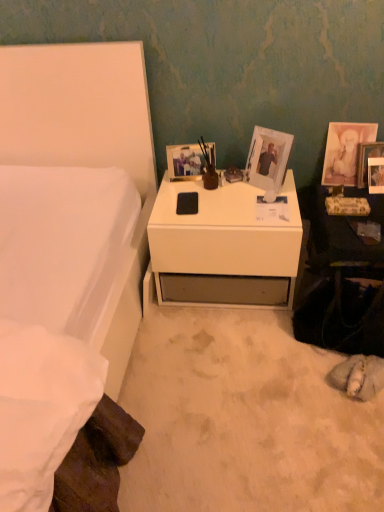
This screenshot has width=384, height=512. What do you see at coordinates (367, 160) in the screenshot? I see `matte white picture frame at upper right, the 4th picture frame in the left-to-right sequence` at bounding box center [367, 160].

Find the location of a particular element. The height and width of the screenshot is (512, 384). white plastic picture frame at upper center, acting as the 3th picture frame starting from the right is located at coordinates (268, 158).

What is the approximate width of matte white picture frame at upper right, acting as the second picture frame starting from the right?

matte white picture frame at upper right, acting as the second picture frame starting from the right, is 2.50 inches wide.

The image size is (384, 512). In order to click on white matte bed at left in this screenshot , I will do `click(87, 148)`.

Find the location of a particular element. matte plastic picture frame at center, the fourth picture frame from the right is located at coordinates (185, 162).

I want to click on matte white picture frame at upper right, the 4th picture frame in the left-to-right sequence, so click(367, 160).

From the image's perspective, between white matte bed at left and white matte desk at center, who is located below?

white matte bed at left appears lower in the image.

Is white matte bed at left to the left of white matte desk at center from the viewer's perspective?

Yes, white matte bed at left is to the left of white matte desk at center.

Choose the correct answer: Is white matte bed at left inside white matte desk at center or outside it?

white matte bed at left is outside white matte desk at center.

In terms of width, does white matte bed at left look wider or thinner when compared to white matte desk at center?

In the image, white matte bed at left appears to be wider than white matte desk at center.

Is white plastic picture frame at upper center, acting as the 3th picture frame starting from the right, aimed at matte plastic picture frame at center, the first picture frame positioned from the left?

No, white plastic picture frame at upper center, acting as the 3th picture frame starting from the right, is not oriented towards matte plastic picture frame at center, the first picture frame positioned from the left.

From the image's perspective, which is above, white plastic picture frame at upper center, acting as the 3th picture frame starting from the right, or matte plastic picture frame at center, the fourth picture frame from the right?

matte plastic picture frame at center, the fourth picture frame from the right, appears higher in the image.

Is white plastic picture frame at upper center, acting as the 3th picture frame starting from the right, positioned behind matte plastic picture frame at center, the first picture frame positioned from the left?

No, white plastic picture frame at upper center, acting as the 3th picture frame starting from the right, is closer to the viewer.

Which object is positioned more to the left, white plastic picture frame at upper center, acting as the 3th picture frame starting from the right, or matte plastic picture frame at center, the fourth picture frame from the right?

matte plastic picture frame at center, the fourth picture frame from the right, is more to the left.

Considering the positions of objects white plastic picture frame at upper center, acting as the 3th picture frame starting from the right, and matte white picture frame at upper right, acting as the second picture frame starting from the right, in the image provided, who is more to the right, white plastic picture frame at upper center, acting as the 3th picture frame starting from the right, or matte white picture frame at upper right, acting as the second picture frame starting from the right,?

Positioned to the right is matte white picture frame at upper right, acting as the second picture frame starting from the right.

Looking at this image, does white plastic picture frame at upper center, the second picture frame in the left-to-right sequence, have a greater height compared to matte white picture frame at upper right, the 3th picture frame from the left?

In fact, white plastic picture frame at upper center, the second picture frame in the left-to-right sequence, may be shorter than matte white picture frame at upper right, the 3th picture frame from the left.

Consider the image. From the image's perspective, is white plastic picture frame at upper center, acting as the 3th picture frame starting from the right, above matte white picture frame at upper right, acting as the second picture frame starting from the right?

No.

Considering the sizes of objects white plastic picture frame at upper center, the second picture frame in the left-to-right sequence, and matte white picture frame at upper right, acting as the second picture frame starting from the right, in the image provided, who is bigger, white plastic picture frame at upper center, the second picture frame in the left-to-right sequence, or matte white picture frame at upper right, acting as the second picture frame starting from the right,?

white plastic picture frame at upper center, the second picture frame in the left-to-right sequence.

How distant is matte white picture frame at upper right, acting as the 1th picture frame starting from the right, from matte white picture frame at upper right, the 3th picture frame from the left?

matte white picture frame at upper right, acting as the 1th picture frame starting from the right, and matte white picture frame at upper right, the 3th picture frame from the left, are 2.72 inches apart.

Is matte white picture frame at upper right, acting as the 1th picture frame starting from the right, facing away from matte white picture frame at upper right, acting as the second picture frame starting from the right?

Correct, matte white picture frame at upper right, acting as the 1th picture frame starting from the right, is looking away from matte white picture frame at upper right, acting as the second picture frame starting from the right.

Considering the relative sizes of matte white picture frame at upper right, the 4th picture frame in the left-to-right sequence, and matte white picture frame at upper right, acting as the second picture frame starting from the right, in the image provided, is matte white picture frame at upper right, the 4th picture frame in the left-to-right sequence, thinner than matte white picture frame at upper right, acting as the second picture frame starting from the right,?

Indeed, matte white picture frame at upper right, the 4th picture frame in the left-to-right sequence, has a lesser width compared to matte white picture frame at upper right, acting as the second picture frame starting from the right.

From the image's perspective, between white matte bed at left and green floral magazine at right, who is located below?

white matte bed at left appears lower in the image.

Between white matte bed at left and green floral magazine at right, which one appears on the right side from the viewer's perspective?

Positioned to the right is green floral magazine at right.

Would you say green floral magazine at right is part of white matte bed at left's contents?

No, green floral magazine at right is not a part of white matte bed at left.

Is white matte bed at left bigger than green floral magazine at right?

Correct, white matte bed at left is larger in size than green floral magazine at right.

Between white matte desk at center and matte white picture frame at upper right, acting as the second picture frame starting from the right, which one has larger size?

Bigger between the two is white matte desk at center.

Identify the location of desk below the matte white picture frame at upper right, acting as the second picture frame starting from the right (from a real-world perspective). (223, 247).

Could you tell me if white matte desk at center is facing matte white picture frame at upper right, acting as the second picture frame starting from the right?

No, white matte desk at center is not turned towards matte white picture frame at upper right, acting as the second picture frame starting from the right.

Does white matte desk at center appear on the left side of matte white picture frame at upper right, acting as the second picture frame starting from the right?

Correct, you'll find white matte desk at center to the left of matte white picture frame at upper right, acting as the second picture frame starting from the right.

Considering the sizes of objects white plastic picture frame at upper center, acting as the 3th picture frame starting from the right, and green floral magazine at right in the image provided, who is smaller, white plastic picture frame at upper center, acting as the 3th picture frame starting from the right, or green floral magazine at right?

green floral magazine at right.

Consider the image. Which object is closer to the camera, white plastic picture frame at upper center, the second picture frame in the left-to-right sequence, or green floral magazine at right?

white plastic picture frame at upper center, the second picture frame in the left-to-right sequence, is more forward.

Is white plastic picture frame at upper center, the second picture frame in the left-to-right sequence, aimed at green floral magazine at right?

No.

Are white plastic picture frame at upper center, the second picture frame in the left-to-right sequence, and green floral magazine at right beside each other?

white plastic picture frame at upper center, the second picture frame in the left-to-right sequence, and green floral magazine at right are not in contact.

You are a GUI agent. You are given a task and a screenshot of the screen. Output one action in this format:
    pyautogui.click(x=<x>, y=<y>)
    Task: Click on the desk below the white matte bed at left (from a real-world perspective)
    
    Given the screenshot: What is the action you would take?
    pyautogui.click(x=223, y=247)

From the image's perspective, count 1st picture frames upward from the white plastic picture frame at upper center, the second picture frame in the left-to-right sequence, and point to it. Please provide its 2D coordinates.

[(185, 162)]

In the scene shown: Based on their spatial positions, is white matte bed at left or white plastic picture frame at upper center, the second picture frame in the left-to-right sequence, closer to white matte desk at center?

white plastic picture frame at upper center, the second picture frame in the left-to-right sequence, is closer to white matte desk at center.

When comparing their distances from matte plastic picture frame at center, the first picture frame positioned from the left, does white matte desk at center or green floral magazine at right seem closer?

Among the two, white matte desk at center is located nearer to matte plastic picture frame at center, the first picture frame positioned from the left.

From the image, which object appears to be nearer to matte white picture frame at upper right, acting as the 1th picture frame starting from the right, white matte desk at center or matte white picture frame at upper right, acting as the second picture frame starting from the right?

matte white picture frame at upper right, acting as the second picture frame starting from the right, lies closer to matte white picture frame at upper right, acting as the 1th picture frame starting from the right, than the other object.

Looking at the image, which one is located further to green floral magazine at right, matte white picture frame at upper right, acting as the second picture frame starting from the right, or matte plastic picture frame at center, the first picture frame positioned from the left?

The object further to green floral magazine at right is matte plastic picture frame at center, the first picture frame positioned from the left.

Considering their positions, is matte plastic picture frame at center, the first picture frame positioned from the left, positioned further to white matte desk at center than matte white picture frame at upper right, the 4th picture frame in the left-to-right sequence?

matte white picture frame at upper right, the 4th picture frame in the left-to-right sequence, is further to white matte desk at center.

Based on their spatial positions, is white matte desk at center or matte white picture frame at upper right, the 3th picture frame from the left, closer to white plastic picture frame at upper center, the second picture frame in the left-to-right sequence?

Among the two, white matte desk at center is located nearer to white plastic picture frame at upper center, the second picture frame in the left-to-right sequence.

Which object lies nearer to the anchor point white plastic picture frame at upper center, the second picture frame in the left-to-right sequence, matte white picture frame at upper right, acting as the second picture frame starting from the right, or matte white picture frame at upper right, acting as the 1th picture frame starting from the right?

matte white picture frame at upper right, acting as the second picture frame starting from the right.

When comparing their distances from matte white picture frame at upper right, acting as the second picture frame starting from the right, does white matte desk at center or white matte bed at left seem further?

white matte bed at left lies further to matte white picture frame at upper right, acting as the second picture frame starting from the right, than the other object.

Where is `picture frame between matte plastic picture frame at center, the first picture frame positioned from the left, and green floral magazine at right from left to right`? The image size is (384, 512). picture frame between matte plastic picture frame at center, the first picture frame positioned from the left, and green floral magazine at right from left to right is located at coordinates (268, 158).

Identify the location of magazine located between white matte bed at left and matte plastic picture frame at center, the fourth picture frame from the right, in the depth direction. This screenshot has height=512, width=384. (347, 206).

This screenshot has height=512, width=384. What are the coordinates of `magazine situated between matte plastic picture frame at center, the first picture frame positioned from the left, and matte white picture frame at upper right, the 3th picture frame from the left, from left to right` in the screenshot? It's located at (347, 206).

Image resolution: width=384 pixels, height=512 pixels. I want to click on magazine located between white matte desk at center and matte white picture frame at upper right, acting as the 1th picture frame starting from the right, in the left-right direction, so click(x=347, y=206).